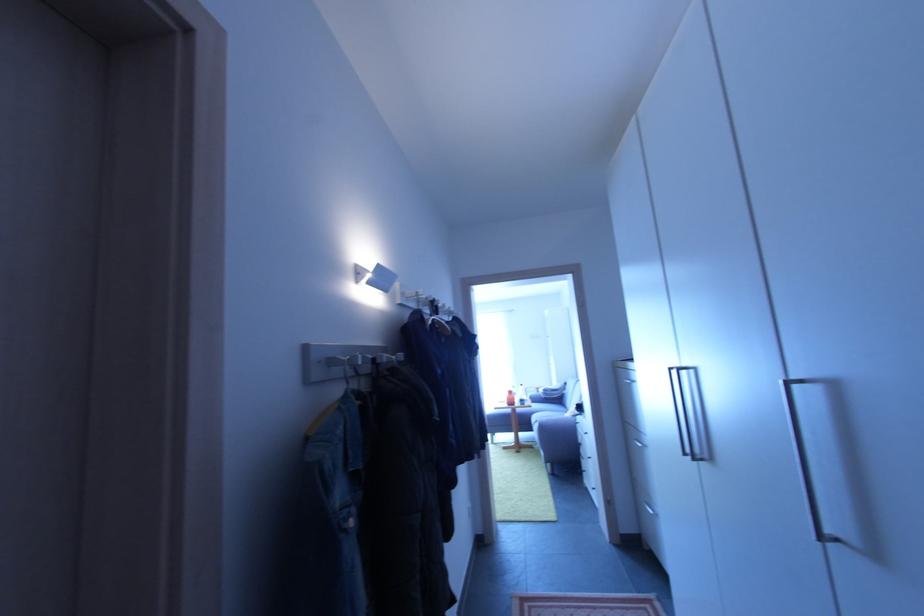
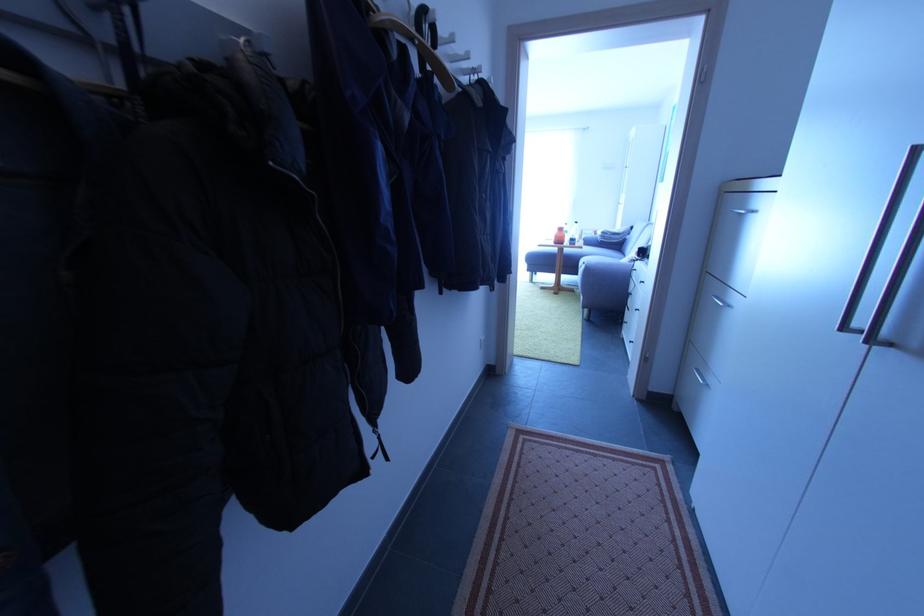
The point at (645, 447) is marked in the first image. Where is the corresponding point in the second image?

(725, 306)